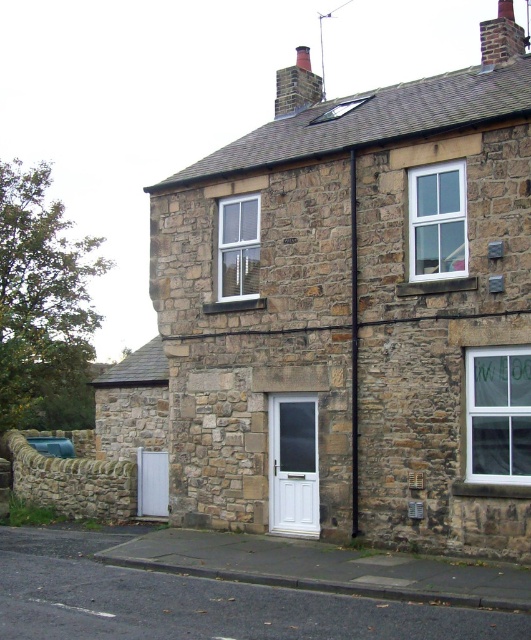
Question: Estimate the real-world distances between objects in this image. Which object is closer to the white plastic door at center?

Choices:
 (A) smooth brick chimney at upper right
 (B) smooth brick chimney at upper center

Answer: (A)

Question: Which object is the closest to the smooth brick chimney at upper center?

Choices:
 (A) white plastic door at center
 (B) smooth brick chimney at upper right

Answer: (B)

Question: In this image, where is white plastic door at center located relative to smooth brick chimney at upper right?

Choices:
 (A) left
 (B) right

Answer: (A)

Question: Which object is the farthest from the white plastic door at center?

Choices:
 (A) smooth brick chimney at upper center
 (B) smooth brick chimney at upper right

Answer: (A)

Question: Does white plastic door at center appear under smooth brick chimney at upper center?

Choices:
 (A) yes
 (B) no

Answer: (A)

Question: In this image, where is smooth brick chimney at upper center located relative to smooth brick chimney at upper right?

Choices:
 (A) below
 (B) above

Answer: (A)